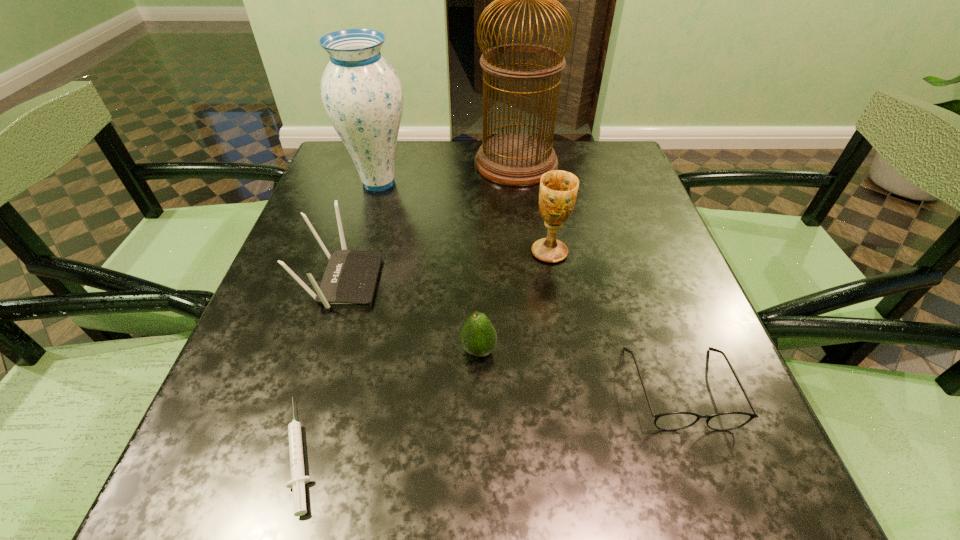
At what (x,y) coordinates should I click in order to perform the action: click on vacant space at the far right corner of the desktop. Please return your answer as a coordinate pair (x, y). Looking at the image, I should click on (599, 184).

I want to click on free space that is in between the fourth shortest object and the vase, so click(361, 232).

Locate an element on the screen. free space between the fourth tallest object and the sixth shortest object is located at coordinates (361, 232).

This screenshot has height=540, width=960. I want to click on vacant area between the sixth shortest object and the fifth shortest object, so click(464, 217).

You are a GUI agent. You are given a task and a screenshot of the screen. Output one action in this format:
    pyautogui.click(x=<x>, y=<y>)
    Task: Click on the free space between the birdcage and the spectacles
    
    Given the screenshot: What is the action you would take?
    pyautogui.click(x=598, y=275)

In order to click on free space that is in between the rightmost object and the birdcage in this screenshot , I will do `click(598, 275)`.

Where is `vacant area that lies between the fourth tallest object and the chalice`? This screenshot has height=540, width=960. vacant area that lies between the fourth tallest object and the chalice is located at coordinates (446, 267).

The image size is (960, 540). Find the location of `free space between the fifth tallest object and the sixth shortest object`. free space between the fifth tallest object and the sixth shortest object is located at coordinates (429, 266).

Locate an element on the screen. The image size is (960, 540). empty space that is in between the tallest object and the avocado is located at coordinates (497, 257).

Identify the location of vacant region between the fourth shortest object and the sixth tallest object. (512, 334).